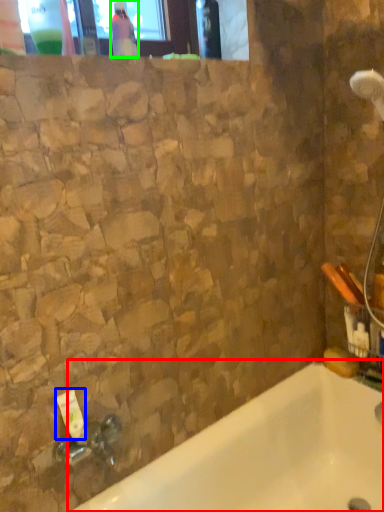
Question: Considering the real-world distances, which object is farthest from bathtub (highlighted by a red box)? toiletry (highlighted by a blue box) or bottle (highlighted by a green box)?

Choices:
 (A) toiletry
 (B) bottle

Answer: (B)